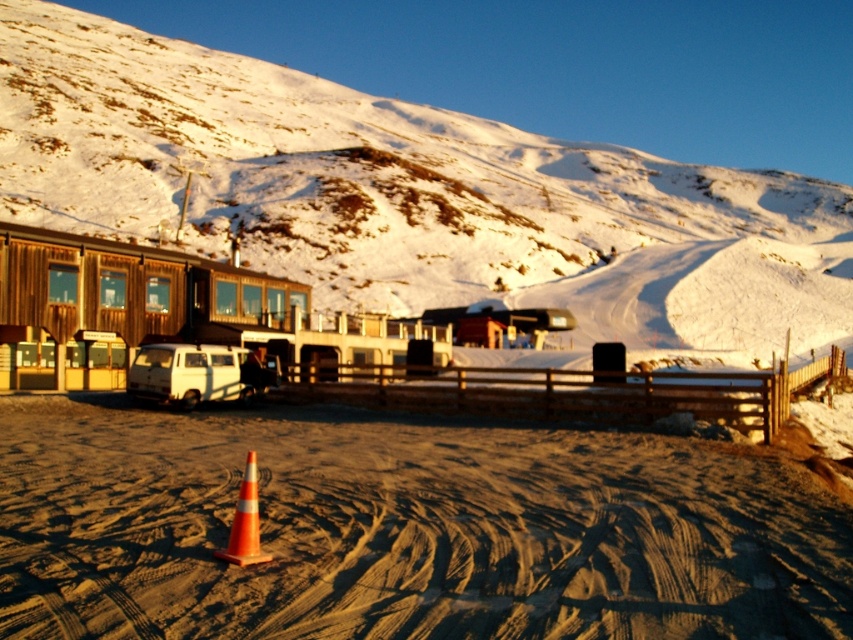
You are a hiker planning to take a photo of the snowy white mountain at upper center. You notice the orange reflective cone at center might block your view. Based on the scene, can you determine if the cone is in front of or behind the mountain?

The orange reflective cone at center is behind snowy white mountain at upper center, so it won not block your view.

You are a delivery driver who needs to park your white matte van at center in a spot that is exactly 20 meters away from the orange reflective cone at center. Based on the scene, can you park your van in the correct position?

The white matte van at center and orange reflective cone at center are 21.04 meters apart, so the van is currently 1.04 meters too far from the cone to meet the 20 meters requirement. You would need to move the van approximately 1 meter closer to the cone to park correctly.

You are planning to drive a truck that is 12 meters long through the area. You see the smooth sand track at center and the white matte van at center. Which one is shorter and can fit your truck?

The smooth sand track at center is shorter than the white matte van at center. Since the truck is 12 meters long, it cannot fit on the smooth sand track at center, but it might fit on the white matte van at center if the van is longer than 12 meters. However, vans are typically much shorter than 12 meters, so the truck likely cannot fit on either.